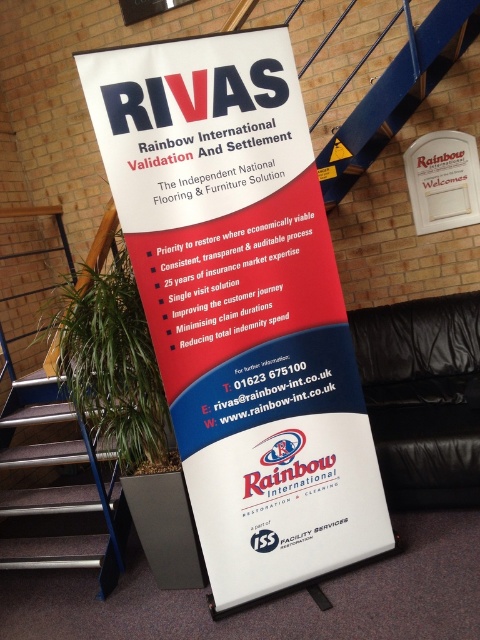
Is the position of white paper poster at center less distant than that of brown carpeted stairs at lower left?

Yes.

Is white paper poster at center to the left of brown carpeted stairs at lower left from the viewer's perspective?

In fact, white paper poster at center is to the right of brown carpeted stairs at lower left.

Between point (288, 252) and point (16, 522), which one is positioned in front?

Point (288, 252) is in front.

The image size is (480, 640). What are the coordinates of `white paper poster at center` in the screenshot? It's located at (240, 305).